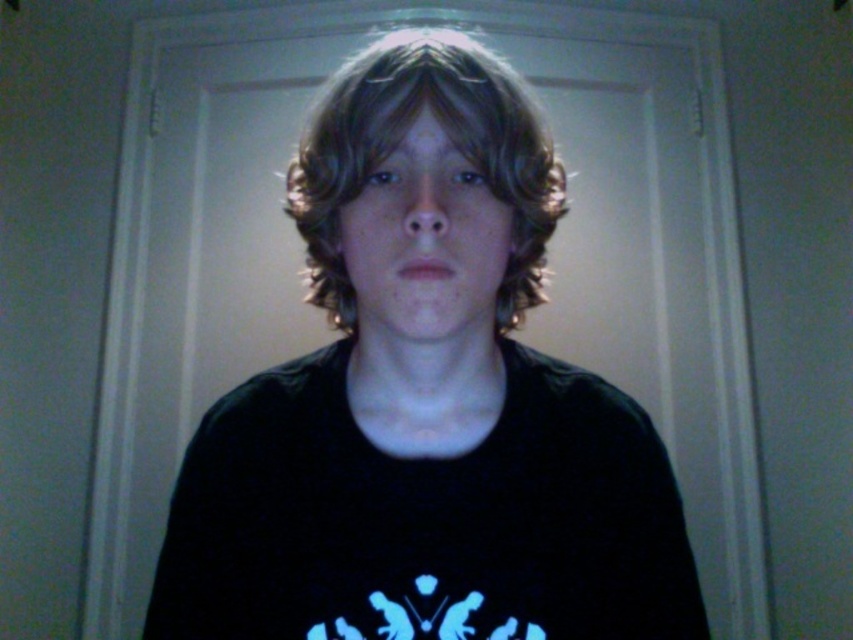
What do you see at coordinates (425, 403) in the screenshot?
I see `black matte shirt at center` at bounding box center [425, 403].

Is black matte shirt at center smaller than brown wavy hair at center?

Actually, black matte shirt at center might be larger than brown wavy hair at center.

Describe the element at coordinates (425, 403) in the screenshot. I see `black matte shirt at center` at that location.

Find the location of a particular element. The height and width of the screenshot is (640, 853). black matte shirt at center is located at coordinates (425, 403).

Is black matte shirt at center above black matte t-shirt at center?

Indeed, black matte shirt at center is positioned over black matte t-shirt at center.

Who is shorter, black matte shirt at center or black matte t-shirt at center?

With less height is black matte t-shirt at center.

Identify the location of black matte shirt at center. (425, 403).

Is black matte t-shirt at center smaller than brown wavy hair at center?

Yes, black matte t-shirt at center is smaller than brown wavy hair at center.

Is point (263, 592) farther from camera compared to point (537, 221)?

Yes, point (263, 592) is farther from viewer.

Who is more distant from viewer, (316, 529) or (561, 198)?

The point (561, 198) is more distant.

At what (x,y) coordinates should I click in order to perform the action: click on black matte t-shirt at center. Please return your answer as a coordinate pair (x, y). Looking at the image, I should click on (425, 518).